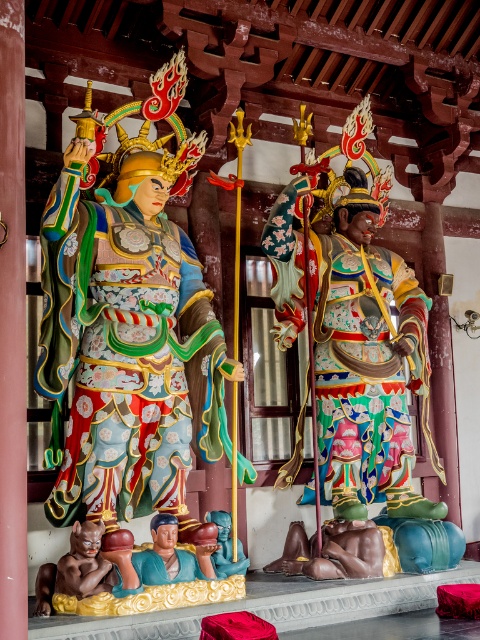
Question: Does matte painted statue at left have a larger size compared to multicolored painted statue at center?

Choices:
 (A) yes
 (B) no

Answer: (A)

Question: Which object appears farthest from the camera in this image?

Choices:
 (A) multicolored painted statue at center
 (B) smooth blue statue at lower center
 (C) matte painted statue at left

Answer: (A)

Question: Considering the real-world distances, which object is closest to the smooth blue statue at center?

Choices:
 (A) multicolored painted statue at center
 (B) matte painted statue at left
 (C) smooth blue statue at lower center
 (D) matte brown statue at lower left

Answer: (C)

Question: Which point is farther to the camera?

Choices:
 (A) (210, 528)
 (B) (91, 557)
 (C) (94, 225)
 (D) (216, 573)

Answer: (C)

Question: Can you confirm if matte painted statue at left is wider than smooth blue statue at lower center?

Choices:
 (A) no
 (B) yes

Answer: (B)

Question: Does multicolored painted statue at center appear on the left side of smooth blue statue at center?

Choices:
 (A) no
 (B) yes

Answer: (A)